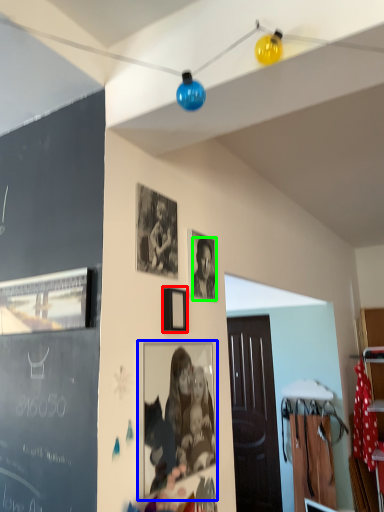
Question: Which is nearer to the picture frame (highlighted by a red box)? picture frame (highlighted by a blue box) or person (highlighted by a green box).

Choices:
 (A) picture frame
 (B) person

Answer: (B)